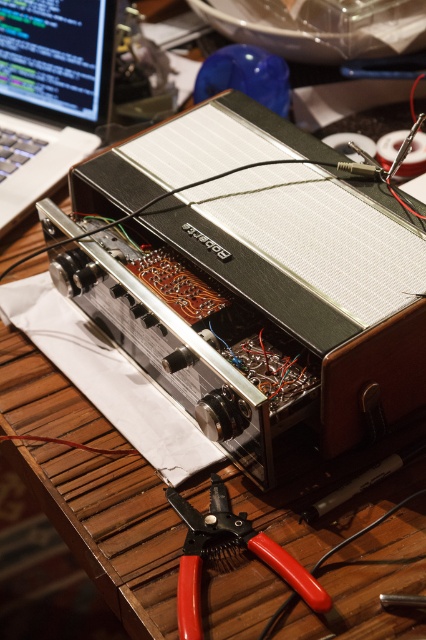
Can you confirm if matte black laptop at upper left is smaller than red plastic pliers at lower center?

No.

In the scene shown: Which is more to the left, matte black laptop at upper left or red plastic pliers at lower center?

matte black laptop at upper left is more to the left.

Locate an element on the screen. The width and height of the screenshot is (426, 640). matte black laptop at upper left is located at coordinates (49, 93).

Can you confirm if metallic silver amplifier at center is taller than matte black laptop at upper left?

Yes.

From the picture: Is metallic silver amplifier at center smaller than matte black laptop at upper left?

Actually, metallic silver amplifier at center might be larger than matte black laptop at upper left.

Locate an element on the screen. Image resolution: width=426 pixels, height=640 pixels. metallic silver amplifier at center is located at coordinates (250, 278).

Who is lower down, metallic silver amplifier at center or red plastic pliers at lower center?

Positioned lower is red plastic pliers at lower center.

Is metallic silver amplifier at center above red plastic pliers at lower center?

Indeed, metallic silver amplifier at center is positioned over red plastic pliers at lower center.

Identify the location of metallic silver amplifier at center. This screenshot has width=426, height=640. (250, 278).